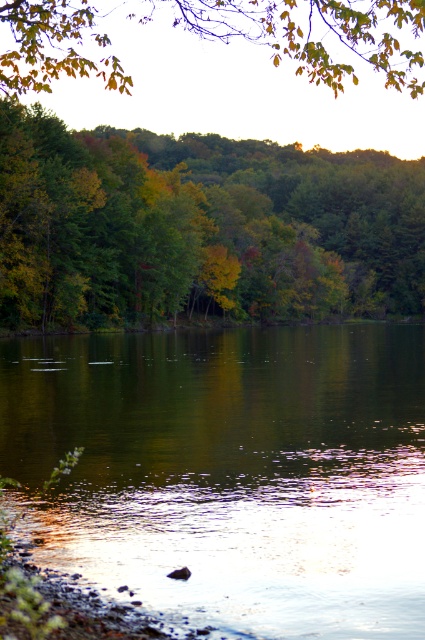
You are standing at the point labeled point (39, 168) in the scene. If you want to take a photo of the entire lakeside area, would you need to move closer or farther away from your current position?

Since point (39, 168) is 336.74 feet away from the camera, you would need to move closer to capture the entire lakeside area in one photo.

You are an observer looking at the serene lakeside scene. You notice two elements in the upper part of the image, the green leafy tree at upper left and the green matte leaves at upper center. Which of these two is positioned lower in the image?

The green leafy tree at upper left is positioned lower than the green matte leaves at upper center in the image.